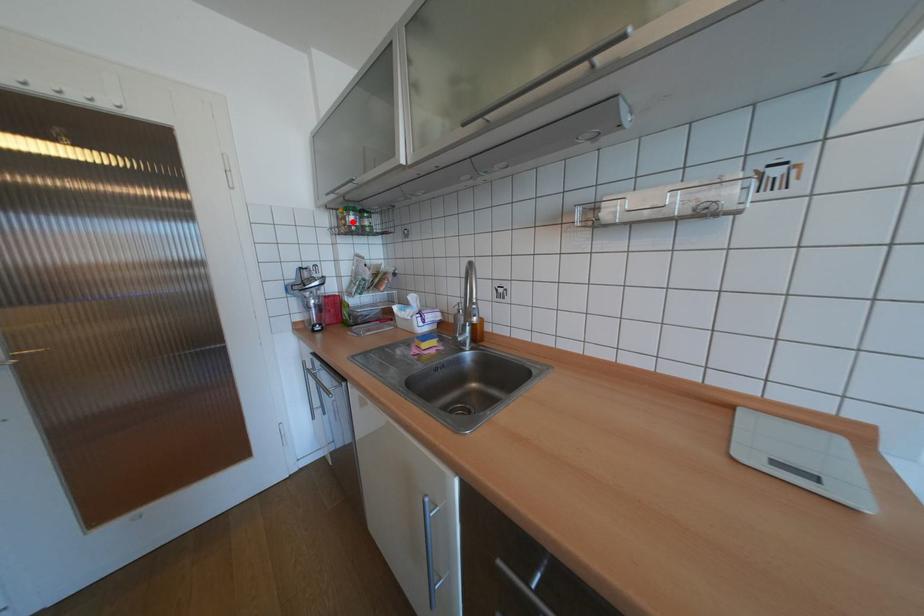
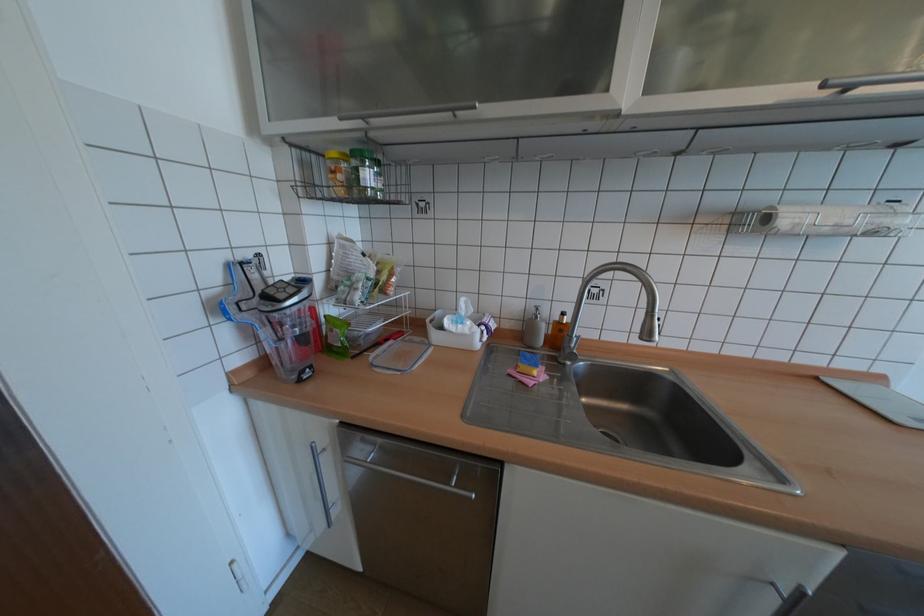
Locate, in the second image, the point that corresponds to the highlighted location in the first image.

(348, 177)